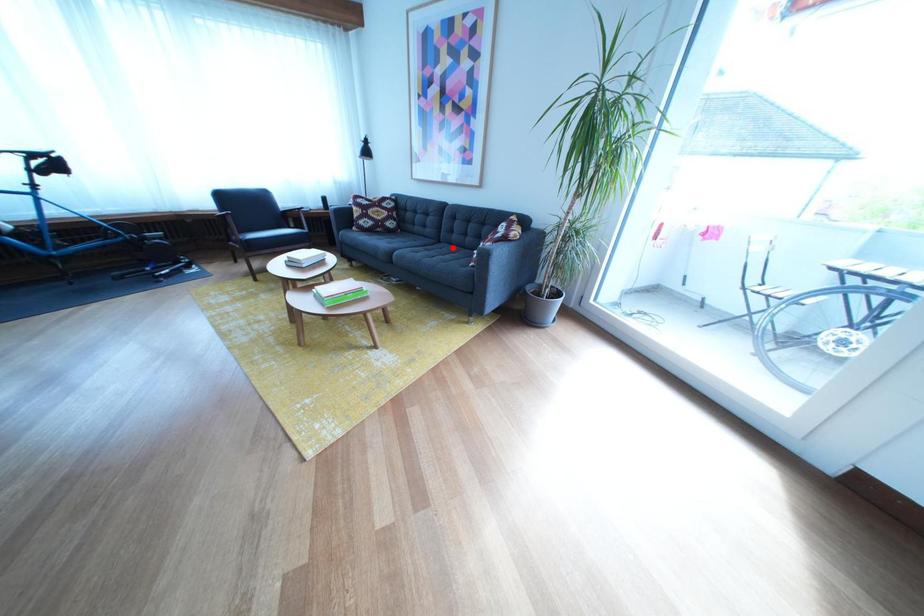
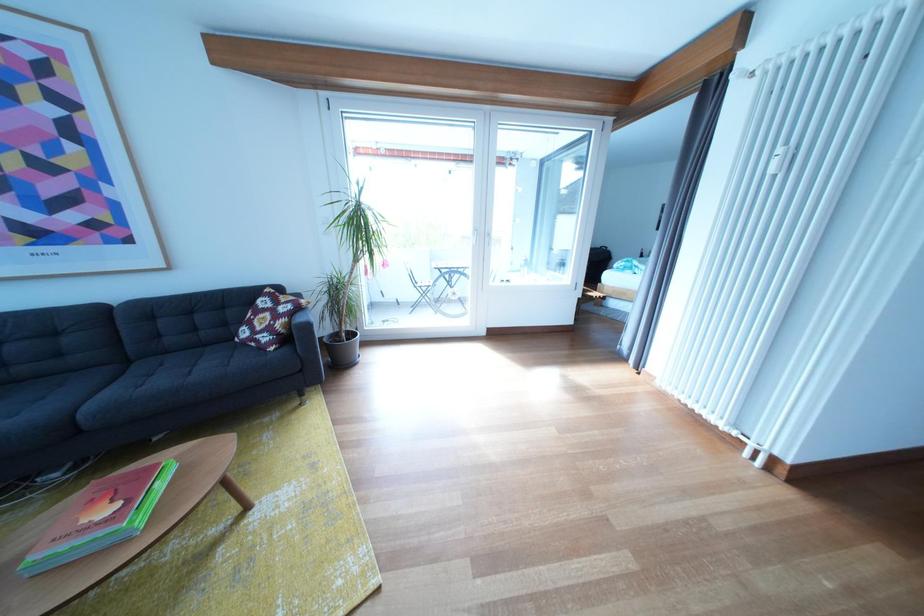
Locate, in the second image, the point that corresponds to the highlighted location in the first image.

(141, 368)